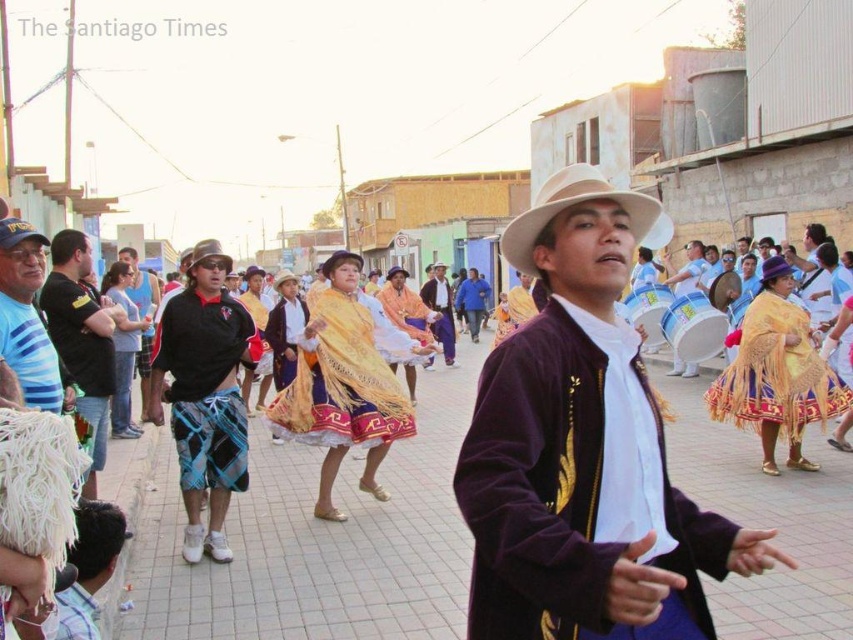
You are a costume designer preparing for a performance. You have two items at center stage, the golden woven shawl at center and the brown leather jacket at center. Which item is wider?

The golden woven shawl at center is wider than the brown leather jacket at center.

You are a photographer at the event and want to capture a photo where both the matte gold drum at center and the straw hat at center are visible. Based on their positions, which object should you ensure is in the lower part of your frame?

The matte gold drum at center is below the straw hat at center, so you should ensure the matte gold drum at center is in the lower part of your frame.

Looking at this image, you are standing in the street scene and want to take a photo of the point at coordinates point (364, 321). Your camera has a maximum focus range of 12 meters. Will the camera be able to focus on the point?

The distance of point (364, 321) from viewer is 13.02 meters, which exceeds the camera maximum focus range of 12 meters. Therefore, the camera will not be able to focus on the point.